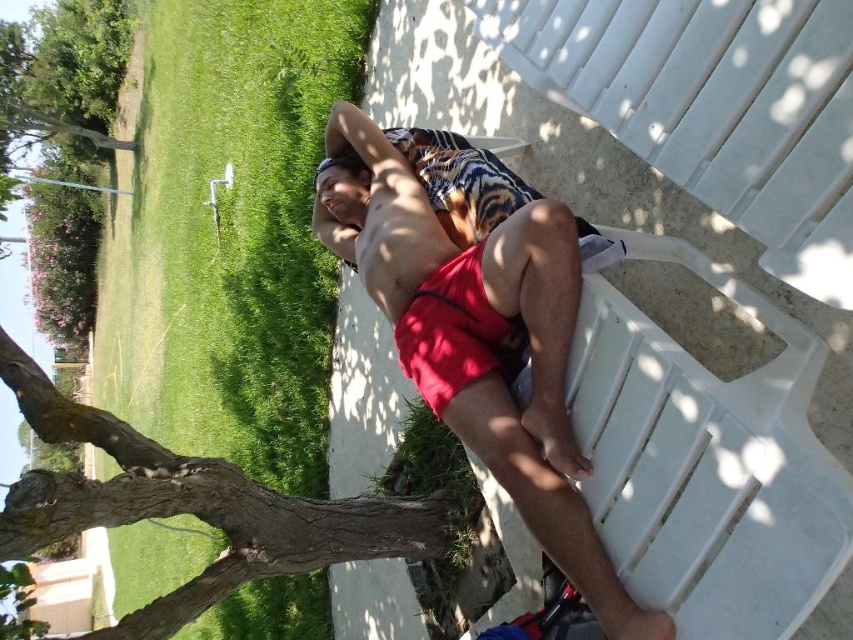
You are standing in the park and see the red fabric shorts at center and the brown rough bark at lower left. Which object is nearer to you?

The red fabric shorts at center is closer to the viewer than the brown rough bark at lower left.

You are standing at the point with coordinates point (364, 497) and want to move to the point (502, 388). According to the scene, which direction should you move in?

You should move forward because point (502, 388) is in front of point (364, 497).